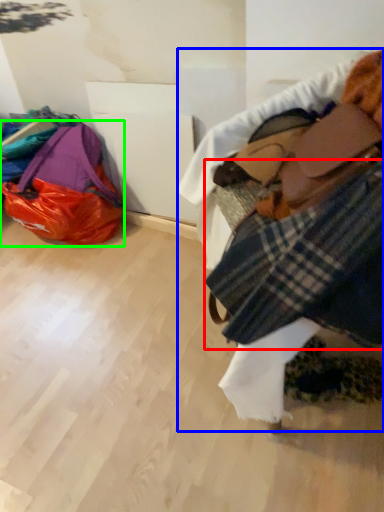
Question: Which is nearer to the flannel (highlighted by a red box)? textile (highlighted by a blue box) or luggage and bags (highlighted by a green box).

Choices:
 (A) textile
 (B) luggage and bags

Answer: (A)